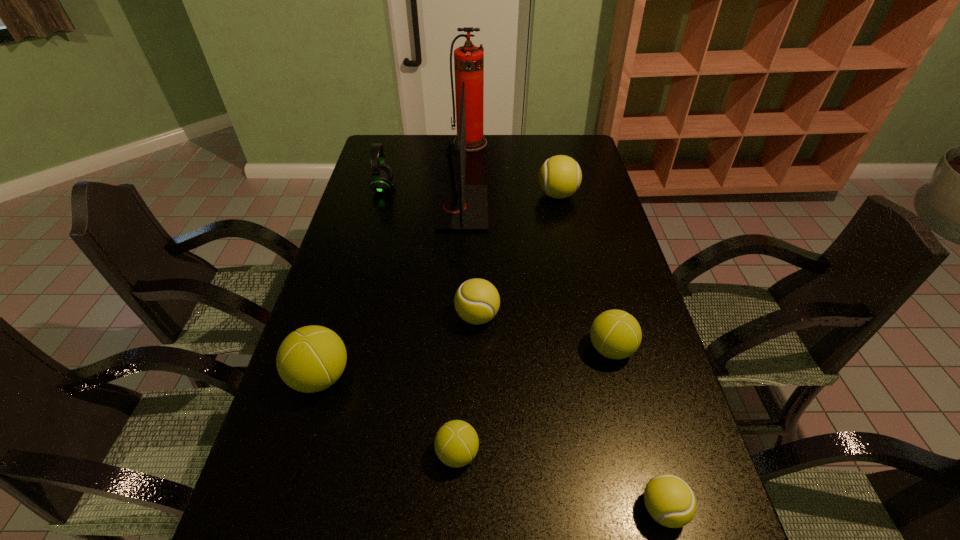
Where is `object that is the fifth closest to the rightmost green tennis ball`? This screenshot has height=540, width=960. object that is the fifth closest to the rightmost green tennis ball is located at coordinates (560, 176).

At what (x,y) coordinates should I click in order to perform the action: click on tennis ball that is the fifth nearest to the fifth farthest tennis ball. Please return your answer as a coordinate pair (x, y). Looking at the image, I should click on (560, 176).

Locate an element on the screen. the second closest tennis ball relative to the eighth shortest object is located at coordinates (477, 301).

Where is `the closest yellow tennis ball to the biggest yellow tennis ball`? The image size is (960, 540). the closest yellow tennis ball to the biggest yellow tennis ball is located at coordinates (477, 301).

Identify which yellow tennis ball is the nearest to the second tallest object. Please provide its 2D coordinates. Your answer should be formatted as a tuple, i.e. [(x, y)], where the tuple contains the x and y coordinates of a point satisfying the conditions above.

[(560, 176)]

Identify which green tennis ball is located as the second nearest to the rightmost green tennis ball. Please provide its 2D coordinates. Your answer should be formatted as a tuple, i.e. [(x, y)], where the tuple contains the x and y coordinates of a point satisfying the conditions above.

[(312, 358)]

Select which green tennis ball is the closest to the smallest green tennis ball. Please provide its 2D coordinates. Your answer should be formatted as a tuple, i.e. [(x, y)], where the tuple contains the x and y coordinates of a point satisfying the conditions above.

[(312, 358)]

Find the location of a particular element. The image size is (960, 540). free space that satisfies the following two spatial constraints: 1. at the discharge end of the tallest object; 2. on the left side of the nearest object is located at coordinates (458, 509).

Locate an element on the screen. Image resolution: width=960 pixels, height=540 pixels. vacant region that satisfies the following two spatial constraints: 1. at the discharge end of the fire extinguisher; 2. on the ear cups of the black headset is located at coordinates (468, 188).

This screenshot has height=540, width=960. Identify the location of free space that satisfies the following two spatial constraints: 1. on the back side of the biggest yellow tennis ball; 2. on the ear cups of the black headset. (556, 188).